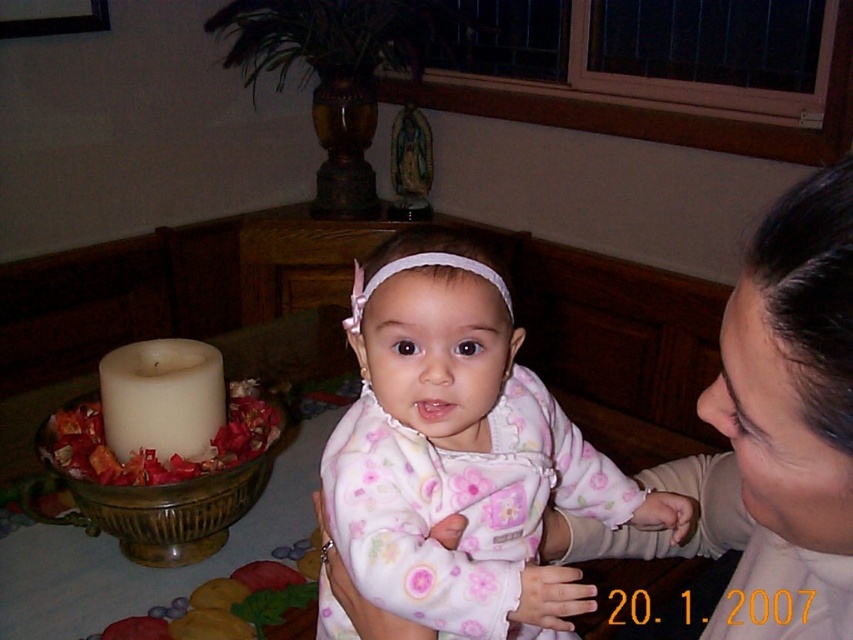
Question: Which point is closer to the camera?

Choices:
 (A) (357, 550)
 (B) (822, 426)

Answer: (B)

Question: Is fluffy pink pajamas at center smaller than smooth beige sweater at upper right?

Choices:
 (A) no
 (B) yes

Answer: (A)

Question: Which object appears farthest from the camera in this image?

Choices:
 (A) smooth beige sweater at upper right
 (B) fluffy pink pajamas at center

Answer: (B)

Question: Can you confirm if fluffy pink pajamas at center is wider than smooth beige sweater at upper right?

Choices:
 (A) no
 (B) yes

Answer: (B)

Question: Can you confirm if fluffy pink pajamas at center is positioned above smooth beige sweater at upper right?

Choices:
 (A) no
 (B) yes

Answer: (A)